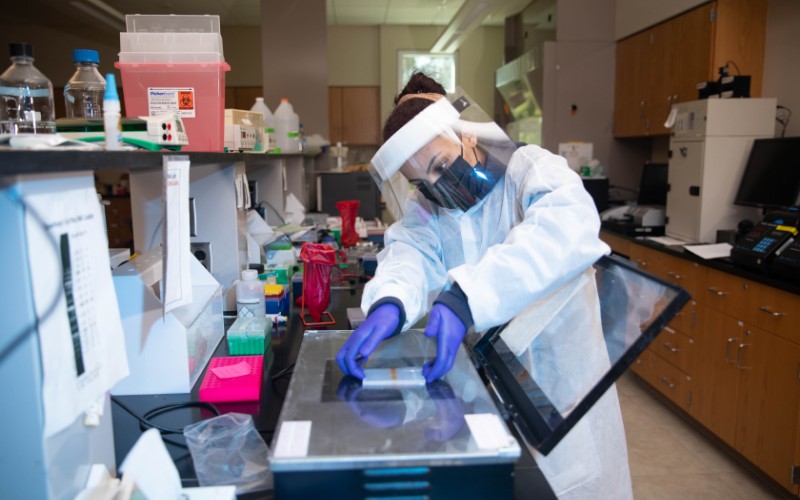
Find the location of a particular element. The width and height of the screenshot is (800, 500). tile floor is located at coordinates (682, 466), (652, 424).